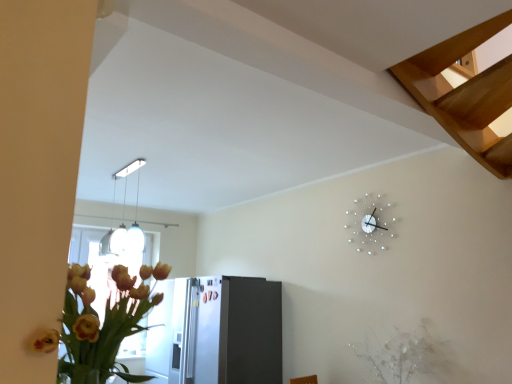
Question: Are white glossy pendant light at upper center and white textured plant at lower right located far from each other?

Choices:
 (A) no
 (B) yes

Answer: (B)

Question: Is white glossy pendant light at upper center oriented towards white textured plant at lower right?

Choices:
 (A) yes
 (B) no

Answer: (B)

Question: Is white textured plant at lower right at the back of white glossy pendant light at upper center?

Choices:
 (A) no
 (B) yes

Answer: (A)

Question: Does white glossy pendant light at upper center appear on the left side of white textured plant at lower right?

Choices:
 (A) yes
 (B) no

Answer: (A)

Question: Is white glossy pendant light at upper center further to the viewer compared to white textured plant at lower right?

Choices:
 (A) yes
 (B) no

Answer: (A)

Question: From a real-world perspective, is white glossy pendant light at upper center located beneath white textured plant at lower right?

Choices:
 (A) yes
 (B) no

Answer: (B)

Question: Is white glossy pendant light at upper center behind satin silver refrigerator at lower center?

Choices:
 (A) no
 (B) yes

Answer: (A)

Question: From a real-world perspective, is white glossy pendant light at upper center on satin silver refrigerator at lower center?

Choices:
 (A) no
 (B) yes

Answer: (B)

Question: Can you confirm if white glossy pendant light at upper center is shorter than satin silver refrigerator at lower center?

Choices:
 (A) yes
 (B) no

Answer: (A)

Question: Is satin silver refrigerator at lower center surrounded by white glossy pendant light at upper center?

Choices:
 (A) yes
 (B) no

Answer: (B)

Question: Is white glossy pendant light at upper center turned away from satin silver refrigerator at lower center?

Choices:
 (A) no
 (B) yes

Answer: (A)

Question: Could you tell me if white glossy pendant light at upper center is facing satin silver refrigerator at lower center?

Choices:
 (A) no
 (B) yes

Answer: (A)

Question: Is white textured plant at lower right surrounding white metallic clock at upper right?

Choices:
 (A) no
 (B) yes

Answer: (A)